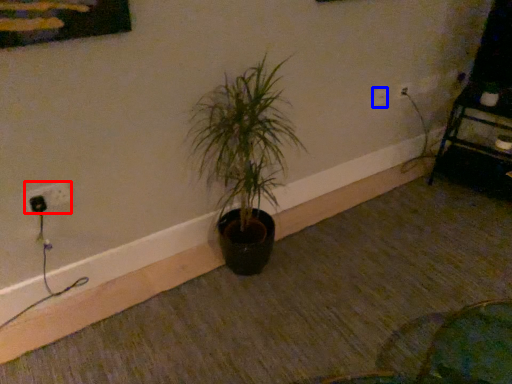
Question: Among these objects, which one is nearest to the camera, electric outlet (highlighted by a red box) or electric outlet (highlighted by a blue box)?

Choices:
 (A) electric outlet
 (B) electric outlet

Answer: (A)